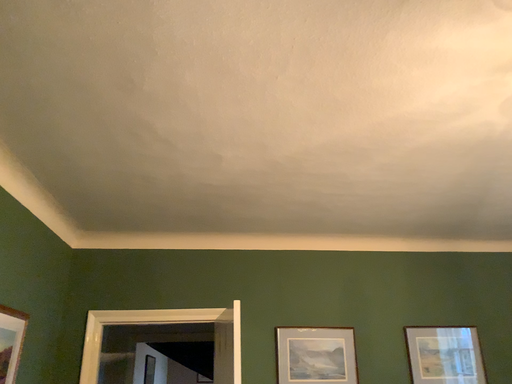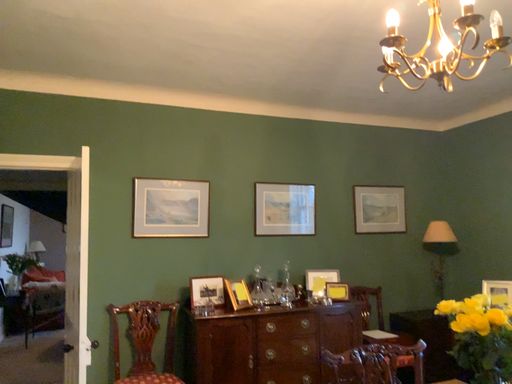
Question: How did the camera likely rotate when shooting the video?

Choices:
 (A) rotated left
 (B) rotated right

Answer: (B)